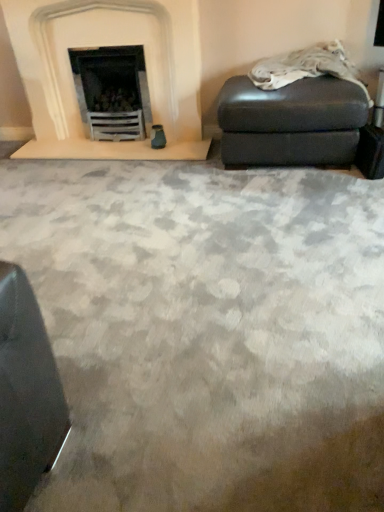
Question: Is leather ottoman at upper right not inside matte gray ottoman at right?

Choices:
 (A) no
 (B) yes

Answer: (A)

Question: Is leather ottoman at upper right closer to camera compared to matte gray ottoman at right?

Choices:
 (A) no
 (B) yes

Answer: (B)

Question: Is leather ottoman at upper right positioned far away from matte gray ottoman at right?

Choices:
 (A) no
 (B) yes

Answer: (A)

Question: Does leather ottoman at upper right have a greater height compared to matte gray ottoman at right?

Choices:
 (A) yes
 (B) no

Answer: (B)

Question: Considering the relative sizes of leather ottoman at upper right and matte gray ottoman at right in the image provided, is leather ottoman at upper right smaller than matte gray ottoman at right?

Choices:
 (A) yes
 (B) no

Answer: (A)

Question: Relative to white stone fireplace at upper left, is leather ottoman at upper right in front or behind?

Choices:
 (A) front
 (B) behind

Answer: (A)

Question: From a real-world perspective, is leather ottoman at upper right physically located above or below white stone fireplace at upper left?

Choices:
 (A) below
 (B) above

Answer: (A)

Question: Visually, is leather ottoman at upper right positioned to the left or to the right of white stone fireplace at upper left?

Choices:
 (A) right
 (B) left

Answer: (A)

Question: Is leather ottoman at upper right wider or thinner than white stone fireplace at upper left?

Choices:
 (A) thin
 (B) wide

Answer: (A)

Question: Is matte gray ottoman at right wider or thinner than white stone fireplace at upper left?

Choices:
 (A) wide
 (B) thin

Answer: (A)

Question: Choose the correct answer: Is matte gray ottoman at right inside white stone fireplace at upper left or outside it?

Choices:
 (A) outside
 (B) inside

Answer: (A)

Question: From the image's perspective, is matte gray ottoman at right located above or below white stone fireplace at upper left?

Choices:
 (A) below
 (B) above

Answer: (A)

Question: From a real-world perspective, is matte gray ottoman at right positioned above or below white stone fireplace at upper left?

Choices:
 (A) below
 (B) above

Answer: (A)

Question: Is white stone fireplace at upper left bigger or smaller than matte gray ottoman at right?

Choices:
 (A) small
 (B) big

Answer: (B)

Question: Would you say white stone fireplace at upper left is to the left or to the right of matte gray ottoman at right in the picture?

Choices:
 (A) right
 (B) left

Answer: (B)